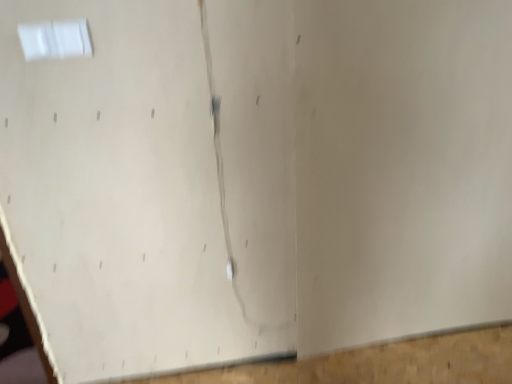
Question: Does wooden at bottom have a lesser height compared to white plastic window at upper left?

Choices:
 (A) no
 (B) yes

Answer: (B)

Question: Does wooden at bottom have a lesser width compared to white plastic window at upper left?

Choices:
 (A) yes
 (B) no

Answer: (B)

Question: Is wooden at bottom oriented towards white plastic window at upper left?

Choices:
 (A) yes
 (B) no

Answer: (B)

Question: Is wooden at bottom smaller than white plastic window at upper left?

Choices:
 (A) no
 (B) yes

Answer: (A)

Question: Can you confirm if wooden at bottom is taller than white plastic window at upper left?

Choices:
 (A) no
 (B) yes

Answer: (A)

Question: Is wooden at bottom next to white plastic window at upper left?

Choices:
 (A) yes
 (B) no

Answer: (B)

Question: Does white plastic window at upper left have a smaller size compared to wooden at bottom?

Choices:
 (A) yes
 (B) no

Answer: (A)

Question: Considering the relative positions of white plastic window at upper left and wooden at bottom in the image provided, is white plastic window at upper left behind wooden at bottom?

Choices:
 (A) no
 (B) yes

Answer: (A)

Question: From the image's perspective, is white plastic window at upper left over wooden at bottom?

Choices:
 (A) no
 (B) yes

Answer: (B)

Question: Can you confirm if white plastic window at upper left is taller than wooden at bottom?

Choices:
 (A) no
 (B) yes

Answer: (B)

Question: From a real-world perspective, is white plastic window at upper left under wooden at bottom?

Choices:
 (A) yes
 (B) no

Answer: (B)

Question: Is wooden at bottom located within white plastic window at upper left?

Choices:
 (A) no
 (B) yes

Answer: (A)

Question: Considering the positions of wooden at bottom and white plastic window at upper left in the image, is wooden at bottom wider or thinner than white plastic window at upper left?

Choices:
 (A) wide
 (B) thin

Answer: (A)